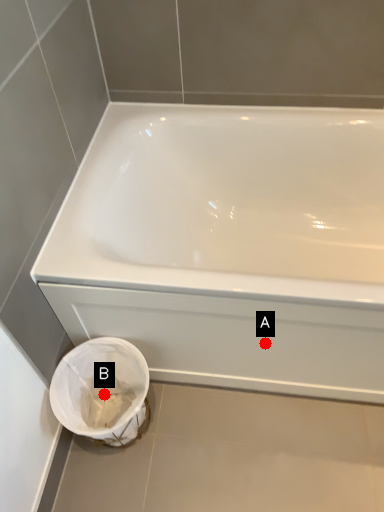
Question: Two points are circled on the image, labeled by A and B beside each circle. Which point is closer to the camera?

Choices:
 (A) A is closer
 (B) B is closer

Answer: (A)